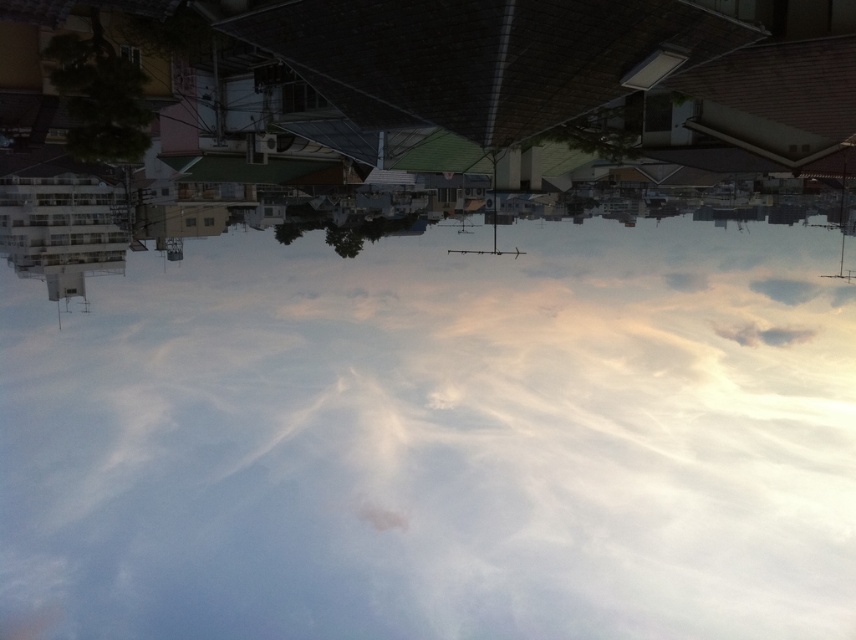
Question: Is white cloud at upper center below white fluffy cloud at upper right?

Choices:
 (A) no
 (B) yes

Answer: (B)

Question: Can you confirm if white cloud at upper center is smaller than white fluffy cloud at upper right?

Choices:
 (A) yes
 (B) no

Answer: (B)

Question: Is white cloud at upper center closer to camera compared to white fluffy cloud at upper right?

Choices:
 (A) no
 (B) yes

Answer: (B)

Question: Which object appears farthest from the camera in this image?

Choices:
 (A) white cloud at upper center
 (B) white fluffy cloud at upper right

Answer: (B)

Question: Which of the following is the farthest from the observer?

Choices:
 (A) white fluffy cloud at upper right
 (B) white cloud at upper center

Answer: (A)